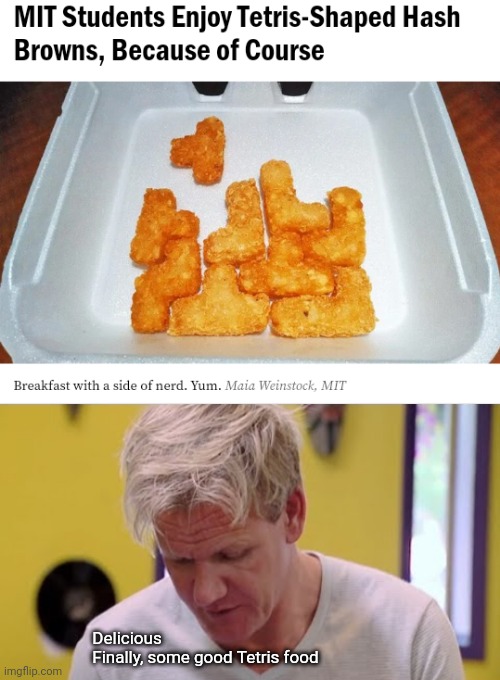
Identify the location of window. The height and width of the screenshot is (680, 500). (435, 515).